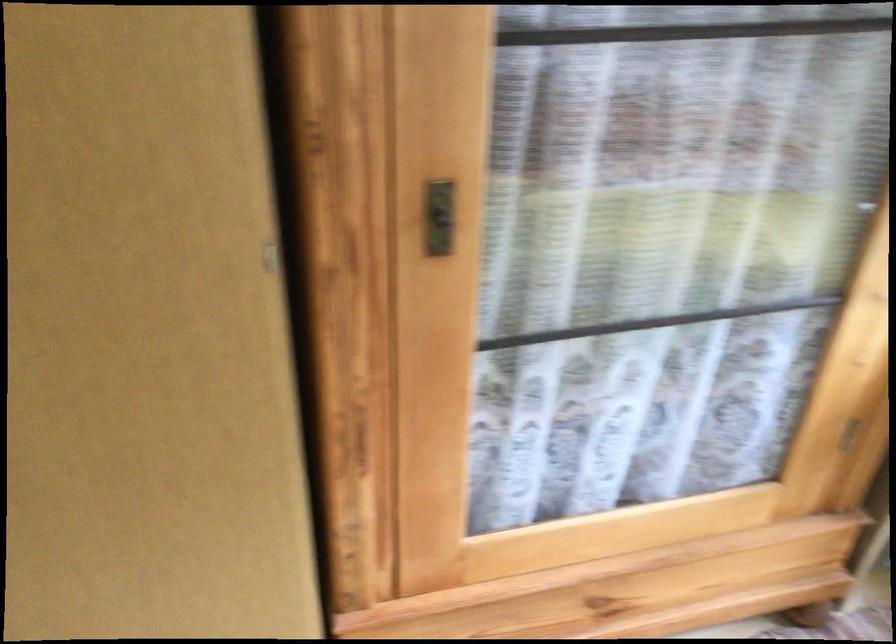
The width and height of the screenshot is (896, 644). What are the coordinates of `metal window latch` in the screenshot? It's located at (438, 218).